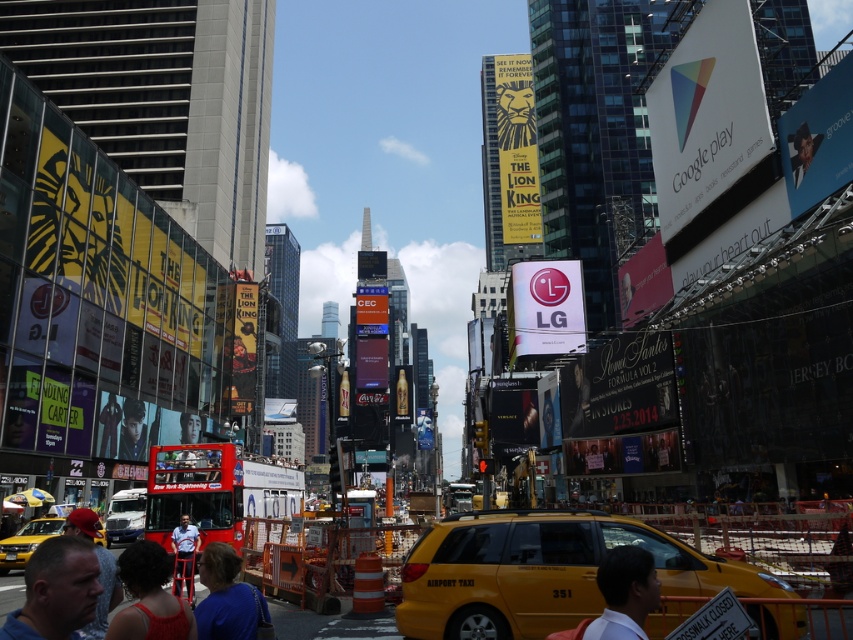
You are a photographer standing in Times Square. You notice a person wearing a blue shirt at lower left and another wearing a white shirt at center. Which shirt is closer to you?

The blue shirt at lower left is closer to the viewer than the white shirt at center.

You are a photographer standing in Times Square. You see a person wearing a blue fabric shirt at lower center and another wearing a red cap at lower left. Which clothing item is more to the right?

The blue fabric shirt at lower center is more to the right than the red cap at lower left.